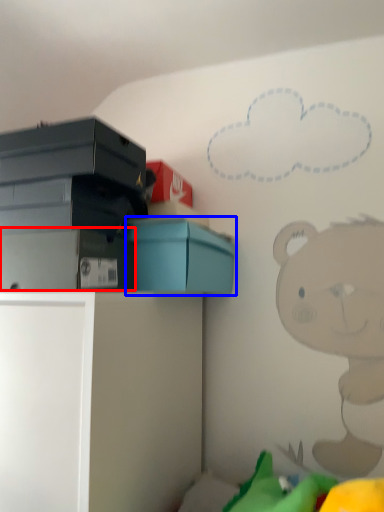
Question: Which object appears closest to the camera in this image, storage box (highlighted by a red box) or box (highlighted by a blue box)?

Choices:
 (A) storage box
 (B) box

Answer: (A)